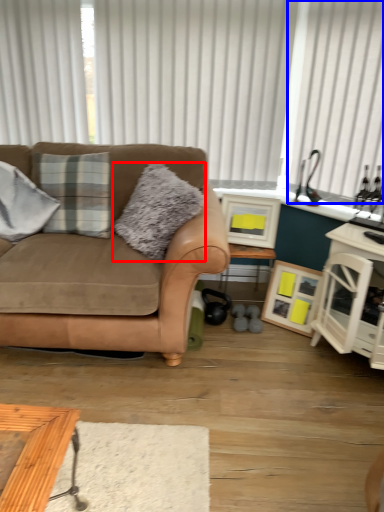
Question: Among these objects, which one is farthest to the camera, pillow (highlighted by a red box) or curtain (highlighted by a blue box)?

Choices:
 (A) pillow
 (B) curtain

Answer: (B)